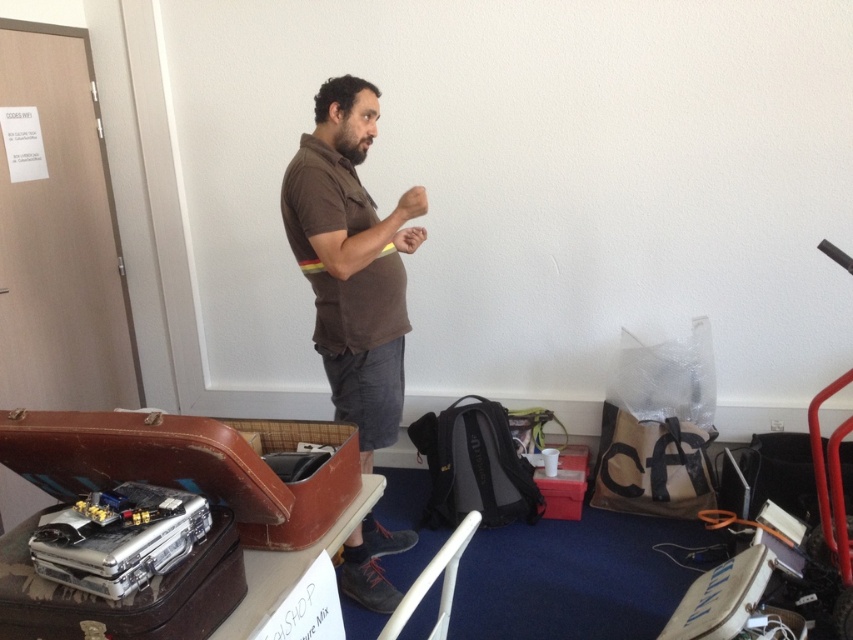
Question: Can you confirm if brown cotton shirt at center is positioned to the right of silver metallic briefcase at lower left?

Choices:
 (A) yes
 (B) no

Answer: (A)

Question: Is brown cotton shirt at center positioned in front of metallic suitcase at lower left?

Choices:
 (A) no
 (B) yes

Answer: (A)

Question: Estimate the real-world distances between objects in this image. Which object is farther from the silver metallic briefcase at lower left?

Choices:
 (A) brown cotton shirt at center
 (B) metallic suitcase at lower left

Answer: (A)

Question: Estimate the real-world distances between objects in this image. Which object is closer to the brown cotton shirt at center?

Choices:
 (A) metallic suitcase at lower left
 (B) silver metallic briefcase at lower left

Answer: (A)

Question: Which is nearer to the silver metallic briefcase at lower left?

Choices:
 (A) brown cotton shirt at center
 (B) metallic suitcase at lower left

Answer: (B)

Question: Is metallic suitcase at lower left further to camera compared to silver metallic briefcase at lower left?

Choices:
 (A) no
 (B) yes

Answer: (B)